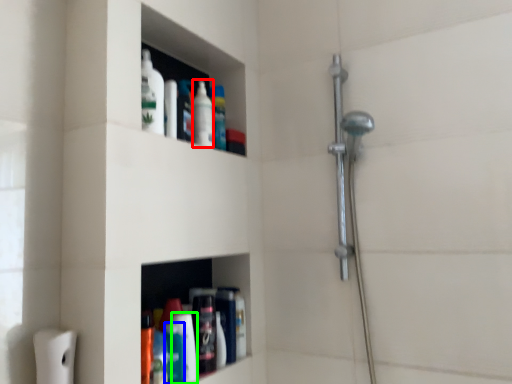
Question: Based on their relative distances, which object is nearer to mouthwash (highlighted by a red box)? Choose from mouthwash (highlighted by a blue box) and cleaning product (highlighted by a green box).

Choices:
 (A) mouthwash
 (B) cleaning product

Answer: (B)